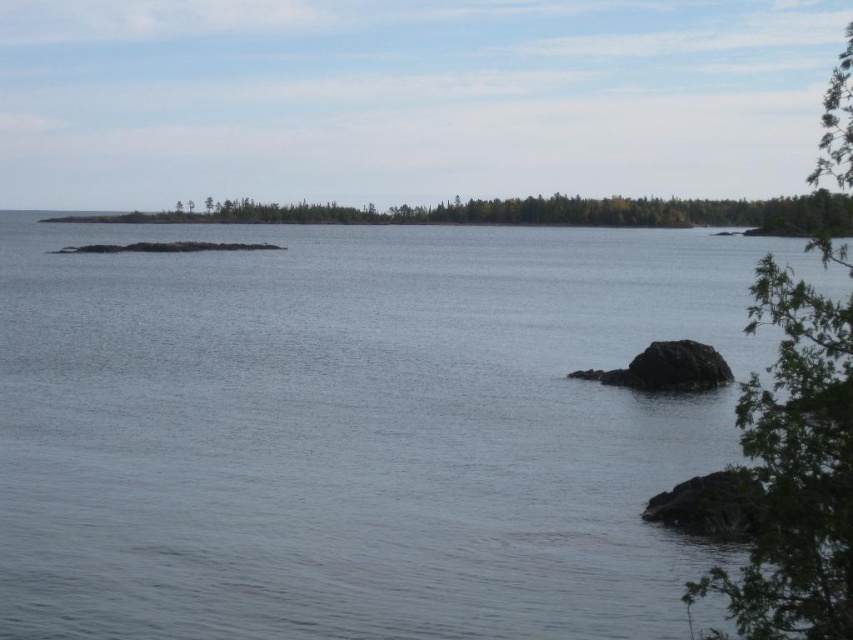
Does clear water at center lie in front of green matte forest at center?

Yes, clear water at center is closer to the viewer.

Is clear water at center above green matte forest at center?

No, clear water at center is not above green matte forest at center.

Consider the image. Who is more distant from viewer, (515, 436) or (671, 209)?

The point (671, 209) is more distant.

Locate an element on the screen. The width and height of the screenshot is (853, 640). clear water at center is located at coordinates (358, 429).

Image resolution: width=853 pixels, height=640 pixels. What do you see at coordinates (795, 468) in the screenshot? I see `green leafy tree at right` at bounding box center [795, 468].

Is point (824, 362) less distant than point (399, 221)?

Yes, it is in front of point (399, 221).

The height and width of the screenshot is (640, 853). I want to click on green leafy tree at right, so click(795, 468).

In the scene shown: Between clear water at center and green leafy tree at right, which one appears on the left side from the viewer's perspective?

From the viewer's perspective, clear water at center appears more on the left side.

Which of these two, clear water at center or green leafy tree at right, stands taller?

Standing taller between the two is green leafy tree at right.

Is point (210, 582) in front of point (834, 83)?

Yes, it is.

The width and height of the screenshot is (853, 640). I want to click on clear water at center, so click(x=358, y=429).